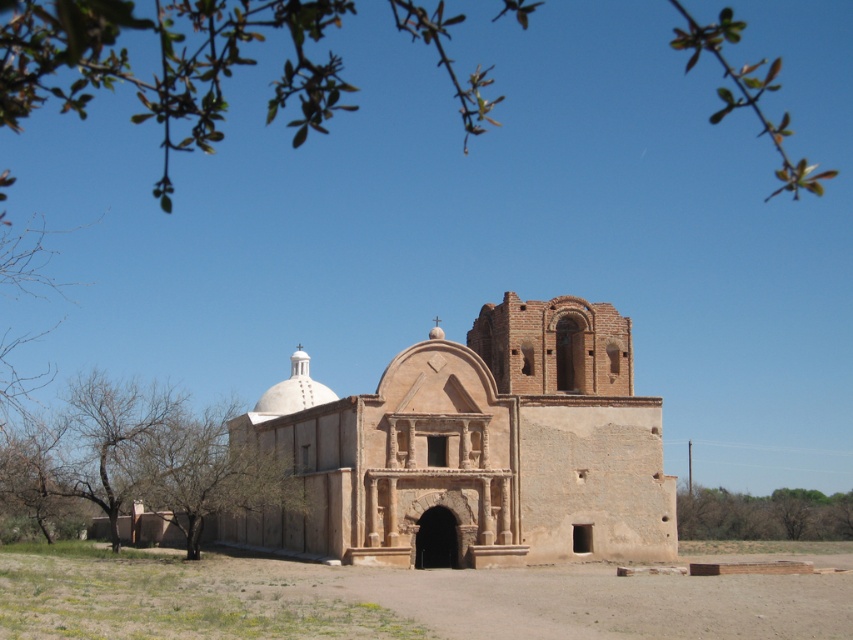
Does brown stone church at center appear on the left side of green leafy branches at upper center?

Incorrect, brown stone church at center is not on the left side of green leafy branches at upper center.

Is brown stone church at center smaller than green leafy branches at upper center?

Yes, brown stone church at center is smaller than green leafy branches at upper center.

Does point (647, 474) come closer to viewer compared to point (83, 0)?

No, it is not.

Where is `brown stone church at center`? The height and width of the screenshot is (640, 853). brown stone church at center is located at coordinates (474, 449).

Can you confirm if brown stone church at center is positioned to the left of green leafy tree at lower right?

Yes, brown stone church at center is to the left of green leafy tree at lower right.

Is point (607, 476) less distant than point (701, 502)?

Yes, it is.

Which is in front, point (587, 525) or point (827, 504)?

Positioned in front is point (587, 525).

This screenshot has width=853, height=640. What are the coordinates of `brown stone church at center` in the screenshot? It's located at click(474, 449).

Does green leafy tree at lower left appear on the right side of green leafy tree at lower right?

In fact, green leafy tree at lower left is to the left of green leafy tree at lower right.

Which is below, green leafy tree at lower left or green leafy tree at lower right?

green leafy tree at lower right is below.

What do you see at coordinates (207, 472) in the screenshot? I see `green leafy tree at lower left` at bounding box center [207, 472].

This screenshot has height=640, width=853. In order to click on green leafy tree at lower left in this screenshot , I will do (207, 472).